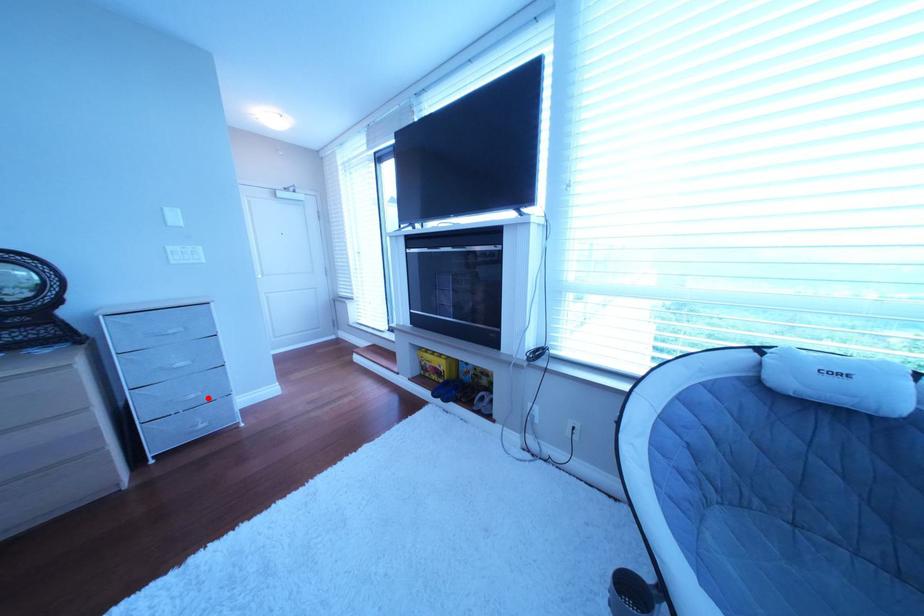
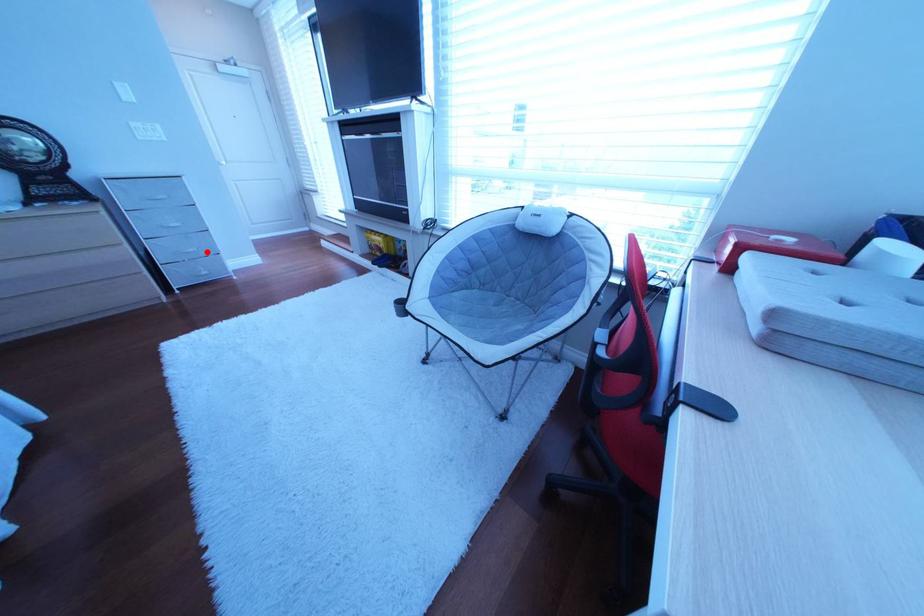
I am providing you with two images of the same scene from different viewpoints. A red point is marked on the first image and another point is marked on the second image. Do the highlighted points in image1 and image2 indicate the same real-world spot?

Yes